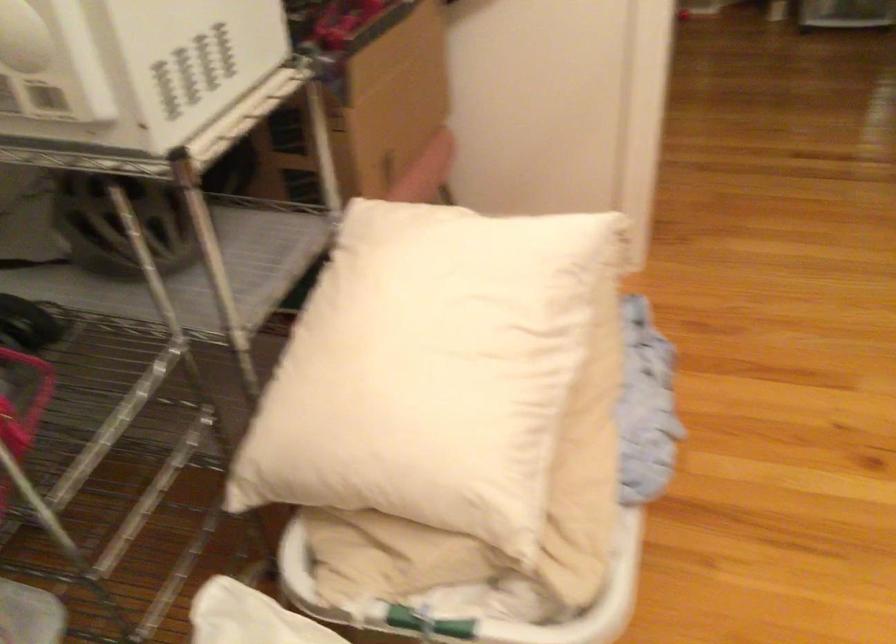
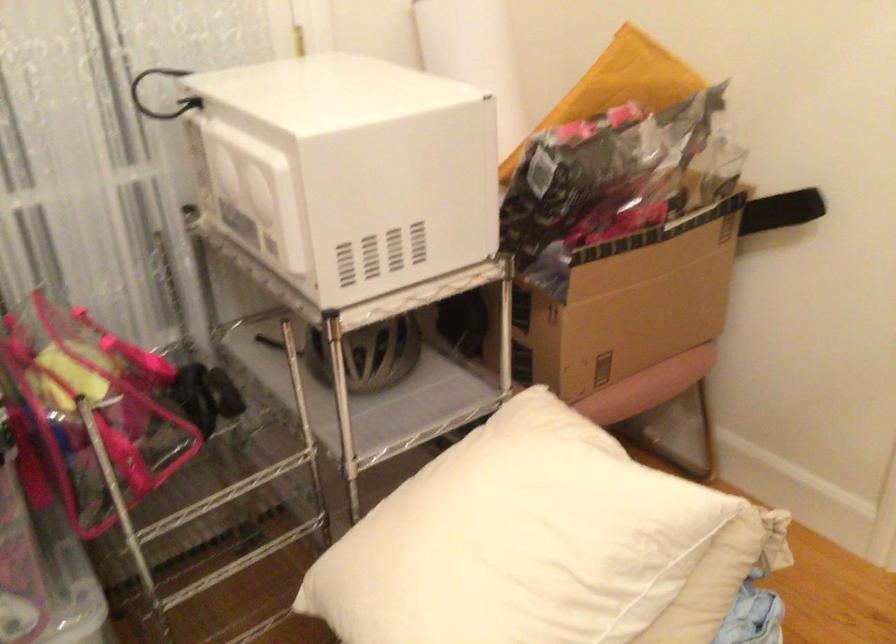
Find the pixel in the second image that matches the point at 406,100 in the first image.

(636, 312)